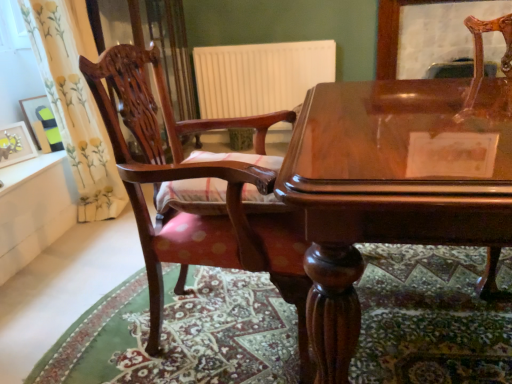
Question: In terms of width, does matte yellow picture frame at left, which is the first picture frame from front to back, look wider or thinner when compared to floral fabric curtain at left?

Choices:
 (A) thin
 (B) wide

Answer: (A)

Question: Looking at the image, does matte yellow picture frame at left, which is the first picture frame from front to back, seem bigger or smaller compared to floral fabric curtain at left?

Choices:
 (A) big
 (B) small

Answer: (B)

Question: Considering the real-world distances, which object is farthest from the glossy wood table at center?

Choices:
 (A) floral fabric curtain at left
 (B) carpeted floor at lower center
 (C) mahogany wood chair at left
 (D) matte black picture frame at left, the second picture frame from the front
 (E) matte yellow picture frame at left, which is the first picture frame from front to back

Answer: (D)

Question: Estimate the real-world distances between objects in this image. Which object is closer to the matte yellow picture frame at left, the 2th picture frame in the back-to-front sequence?

Choices:
 (A) white matte radiator at center
 (B) carpeted floor at lower center
 (C) mahogany wood chair at left
 (D) matte black picture frame at left, the second picture frame from the front
 (E) glossy wood table at center

Answer: (D)